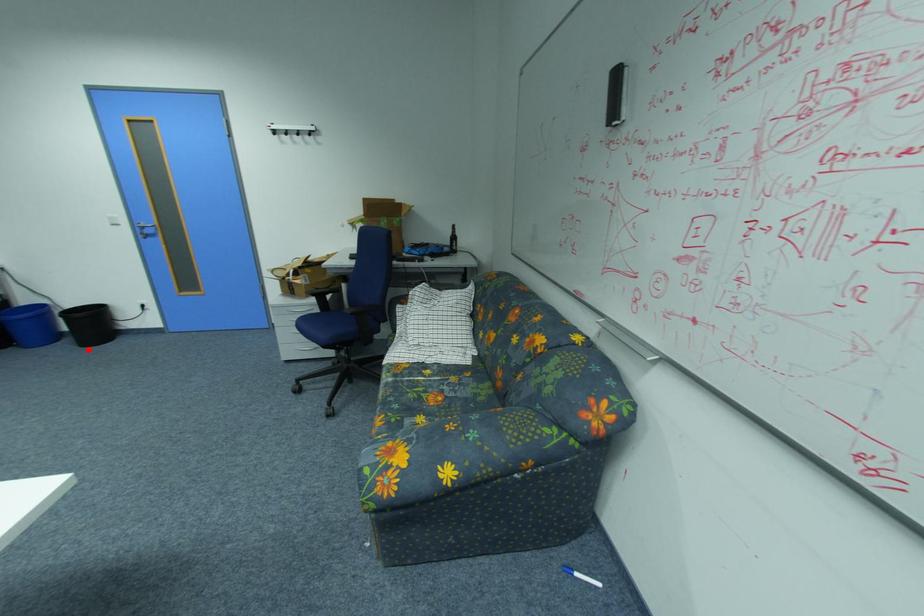
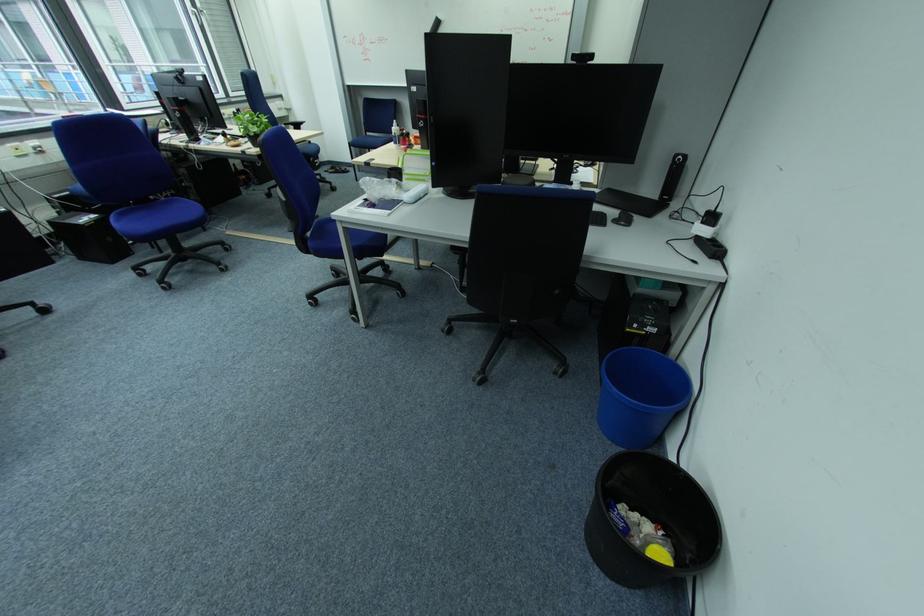
In the second image, find the point that corresponds to the highlighted location in the first image.

(596, 514)